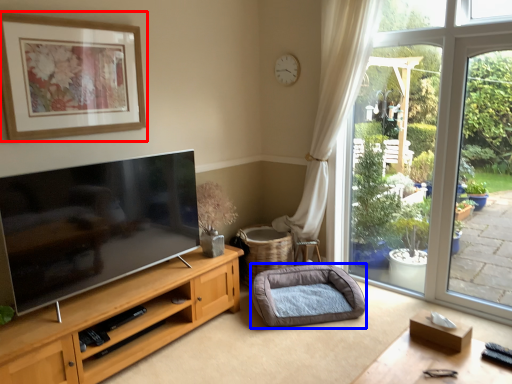
Question: Which of the following is the closest to the observer, picture frame (highlighted by a red box) or dog bed (highlighted by a blue box)?

Choices:
 (A) picture frame
 (B) dog bed

Answer: (A)